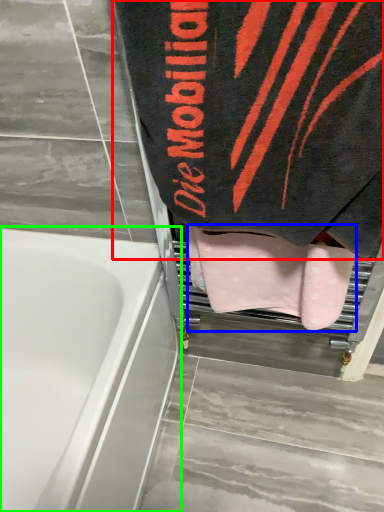
Question: Which object is positioned closest to towel (highlighted by a red box)? Select from towel (highlighted by a blue box) and bathtub (highlighted by a green box).

Choices:
 (A) towel
 (B) bathtub

Answer: (A)